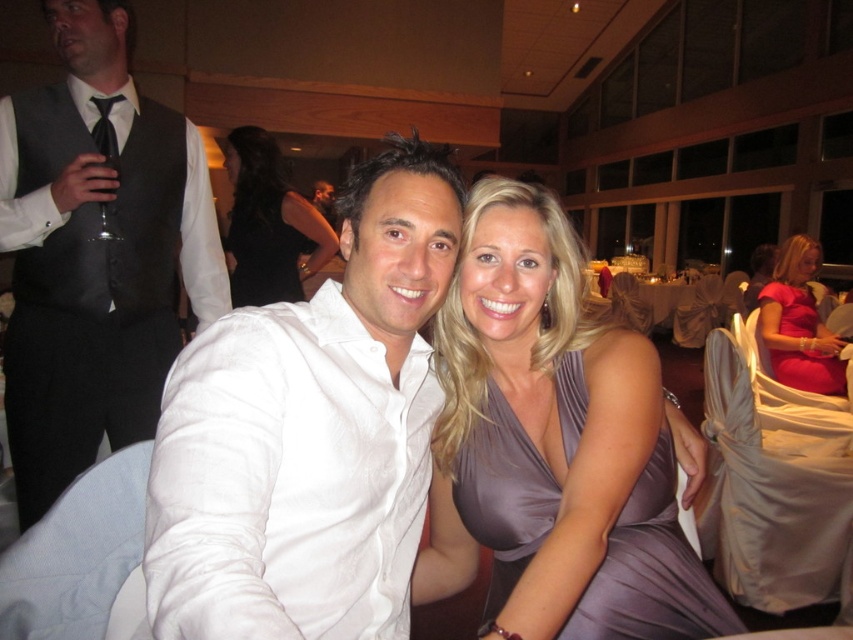
Question: Is matte black vest at left wider than black satin dress at upper center?

Choices:
 (A) no
 (B) yes

Answer: (A)

Question: Which of the following is the farthest from the observer?

Choices:
 (A) matte black vest at left
 (B) black satin dress at center

Answer: (B)

Question: Where is white cotton shirt at center located in relation to matte pink dress at right in the image?

Choices:
 (A) above
 (B) below

Answer: (B)

Question: Does white cotton shirt at center lie behind satin purple dress at center?

Choices:
 (A) yes
 (B) no

Answer: (B)

Question: Which point appears closest to the camera in this image?

Choices:
 (A) (376, 209)
 (B) (784, 252)
 (C) (274, 192)

Answer: (A)

Question: Among these points, which one is farthest from the camera?

Choices:
 (A) (665, 596)
 (B) (404, 300)

Answer: (A)